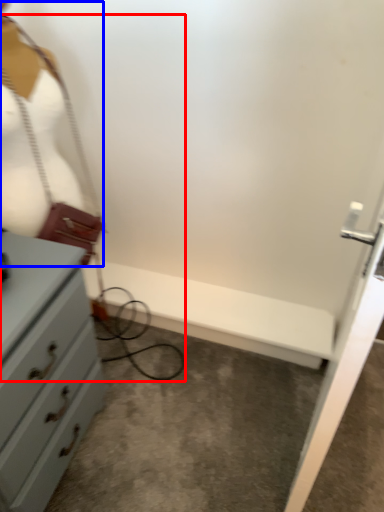
Question: Which of the following is the closest to the observer, wire (highlighted by a red box) or mannequin (highlighted by a blue box)?

Choices:
 (A) wire
 (B) mannequin

Answer: (A)